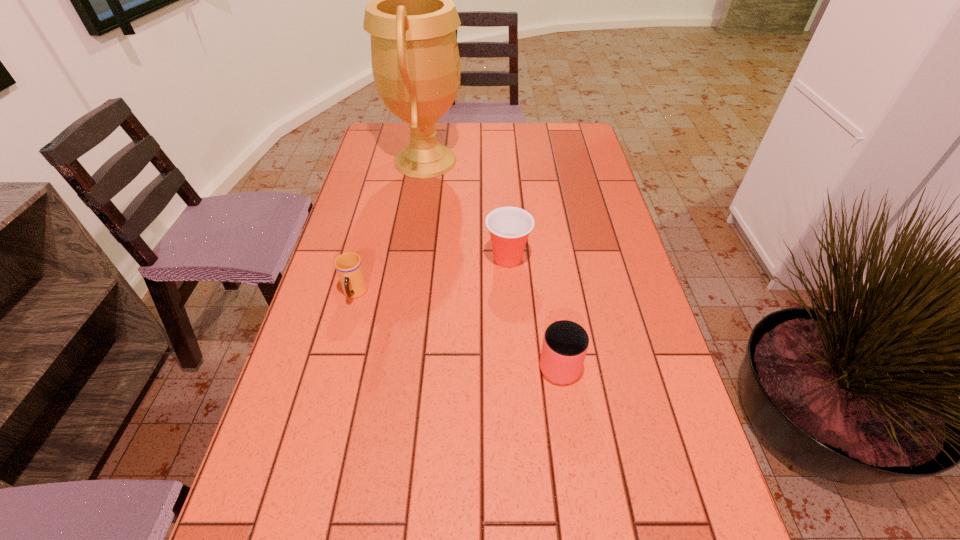
Locate an element on the screen. Image resolution: width=960 pixels, height=540 pixels. free space between the third nearest object and the second nearest object is located at coordinates (431, 276).

At what (x,y) coordinates should I click in order to perform the action: click on vacant area that lies between the nearest cup and the farthest object. Please return your answer as a coordinate pair (x, y). Looking at the image, I should click on (492, 261).

Where is `unoccupied area between the leftmost cup and the second farthest object`? unoccupied area between the leftmost cup and the second farthest object is located at coordinates (431, 276).

Identify the location of vacant space that's between the farthest object and the third nearest object. (467, 210).

At what (x,y) coordinates should I click in order to perform the action: click on vacant area that lies between the farthest cup and the leftmost cup. Please return your answer as a coordinate pair (x, y). The height and width of the screenshot is (540, 960). Looking at the image, I should click on (431, 276).

Locate an element on the screen. The image size is (960, 540). free area in between the second nearest cup and the tallest object is located at coordinates (390, 227).

This screenshot has width=960, height=540. In order to click on vacant point located between the farthest cup and the nearest cup in this screenshot , I will do `click(533, 310)`.

This screenshot has height=540, width=960. Identify the location of free space between the nearest object and the farthest cup. (533, 310).

Image resolution: width=960 pixels, height=540 pixels. Identify the location of vacant area that lies between the trophy and the leftmost cup. (390, 227).

Where is `blank region between the second farthest cup and the second farthest object`? blank region between the second farthest cup and the second farthest object is located at coordinates (431, 276).